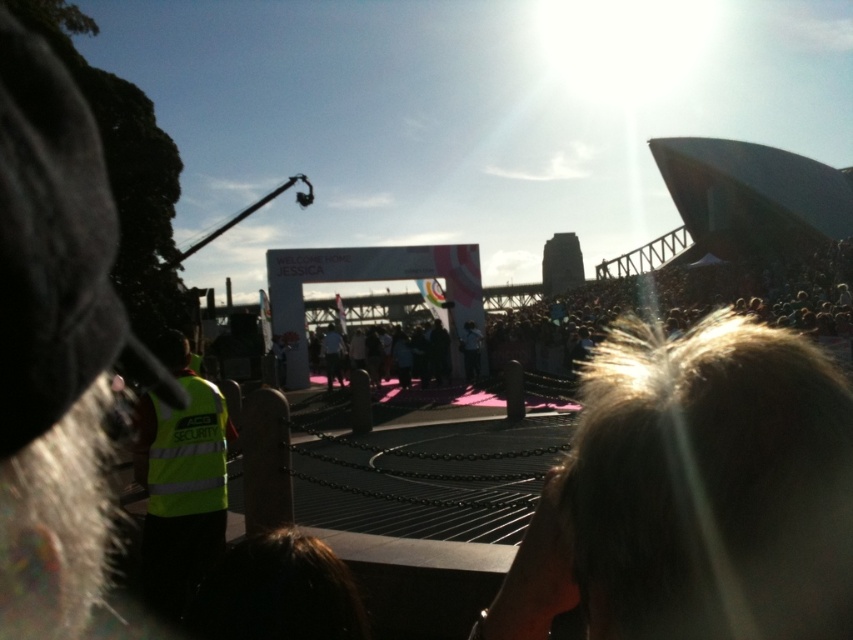
Who is taller, neon yellow reflective vest at lower left or pink fabric crowd at center?

Standing taller between the two is pink fabric crowd at center.

Which is more to the right, neon yellow reflective vest at lower left or pink fabric crowd at center?

Positioned to the right is pink fabric crowd at center.

Locate an element on the screen. Image resolution: width=853 pixels, height=640 pixels. neon yellow reflective vest at lower left is located at coordinates (180, 481).